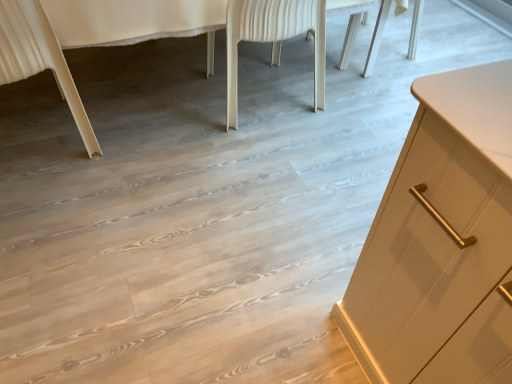
At what (x,y) coordinates should I click in order to perform the action: click on free space behind light beige wood chair leg at lower left, placed as the 1th chair when sorted from left to right. Please return your answer as a coordinate pair (x, y). This screenshot has height=384, width=512. Looking at the image, I should click on (84, 84).